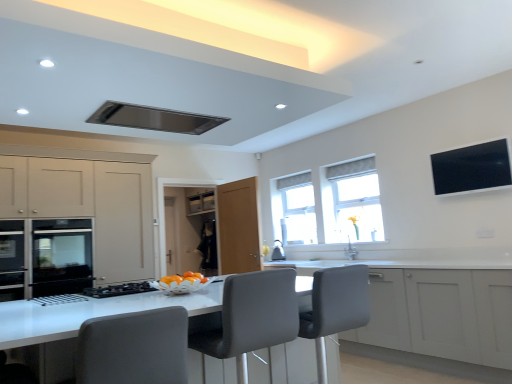
Question: Based on their positions, is transparent glass window at center, which is counted as the 1th window, starting from the left, located to the left or right of matte beige cabinet at left, arranged as the 2th cabinetry when viewed from the right?

Choices:
 (A) left
 (B) right

Answer: (B)

Question: Does point (304, 200) appear closer or farther from the camera than point (19, 291)?

Choices:
 (A) closer
 (B) farther

Answer: (B)

Question: Which is farther from the white matte cabinet at center, acting as the second cabinetry starting from the left?

Choices:
 (A) grey fabric swivel chair at center, marked as the 2th swivel chair in a left-to-right arrangement
 (B) transparent glass window at center, acting as the first window starting from the back
 (C) gray fabric swivel chair at center, the second swivel chair from the right
 (D) white glossy counter at center
 (E) matte black oven at left

Answer: (E)

Question: Which is farther from the black glossy tv at upper right?

Choices:
 (A) matte beige cabinet at left, arranged as the 2th cabinetry when viewed from the right
 (B) matte black oven at left
 (C) grey fabric chair at center
 (D) white matte cabinet at center, acting as the second cabinetry starting from the left
 (E) stainless steel oven at left

Answer: (B)